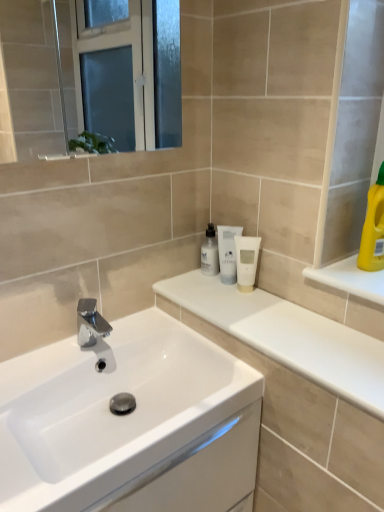
This screenshot has width=384, height=512. What do you see at coordinates (228, 253) in the screenshot? I see `transparent plastic bottle at center, marked as the second mouthwash in a left-to-right arrangement` at bounding box center [228, 253].

You are a GUI agent. You are given a task and a screenshot of the screen. Output one action in this format:
    pyautogui.click(x=<x>, y=<y>)
    Task: Click on the white matte tube at center, which ranks as the 1th mouthwash in right-to-left order
    This screenshot has height=512, width=384.
    Given the screenshot: What is the action you would take?
    pyautogui.click(x=246, y=261)

Describe the element at coordinates (298, 392) in the screenshot. The height and width of the screenshot is (512, 384). I see `white glossy counter at center` at that location.

Measure the distance between white glossy sink at center and camera.

They are 27.22 inches apart.

The width and height of the screenshot is (384, 512). Identify the location of chrome/metallic faucet at center. (90, 323).

I want to click on transparent plastic bottle at center, the second mouthwash from the right, so click(228, 253).

Is transparent plastic bottle at center, marked as the second mouthwash in a left-to-right arrangement, not close to white matte tube at center, positioned as the third mouthwash in left-to-right order?

They are positioned close to each other.

From a real-world perspective, relative to white matte tube at center, which ranks as the 1th mouthwash in right-to-left order, is transparent plastic bottle at center, the second mouthwash from the right, vertically above or below?

transparent plastic bottle at center, the second mouthwash from the right, is above white matte tube at center, which ranks as the 1th mouthwash in right-to-left order.

Is white matte tube at center, positioned as the third mouthwash in left-to-right order, a part of transparent plastic bottle at center, the second mouthwash from the right?

No, white matte tube at center, positioned as the third mouthwash in left-to-right order, is located outside of transparent plastic bottle at center, the second mouthwash from the right.

From the image's perspective, who appears lower, transparent plastic bottle at center, marked as the second mouthwash in a left-to-right arrangement, or white matte tube at center, positioned as the third mouthwash in left-to-right order?

white matte tube at center, positioned as the third mouthwash in left-to-right order, from the image's perspective.

Looking at this image, which object is positioned more to the right, white glossy counter at center or white matte tube at center, positioned as the third mouthwash in left-to-right order?

Positioned to the right is white glossy counter at center.

Are white glossy counter at center and white matte tube at center, positioned as the third mouthwash in left-to-right order, making contact?

No, white glossy counter at center is not with white matte tube at center, positioned as the third mouthwash in left-to-right order.

Is white glossy counter at center inside or outside of white matte tube at center, positioned as the third mouthwash in left-to-right order?

white glossy counter at center is located beyond the bounds of white matte tube at center, positioned as the third mouthwash in left-to-right order.

Which is behind, point (103, 325) or point (105, 489)?

The point (103, 325) is more distant.

Can you confirm if chrome/metallic faucet at center is smaller than white glossy sink at center?

Indeed, chrome/metallic faucet at center has a smaller size compared to white glossy sink at center.

From a real-world perspective, which object rests below the other?

In real-world perspective, white glossy sink at center is lower.

From the image's perspective, is chrome/metallic faucet at center above white glossy sink at center?

Yes, from the image's perspective, chrome/metallic faucet at center is on top of white glossy sink at center.

Is there a large distance between yellow plastic bottle at upper right and white glossy sink at center?

No, there isn't a large distance between yellow plastic bottle at upper right and white glossy sink at center.

Considering the positions of points (367, 269) and (132, 358), is point (367, 269) farther from camera compared to point (132, 358)?

No, it is in front of (132, 358).

How much distance is there between yellow plastic bottle at upper right and white glossy sink at center?

25.41 inches.

In terms of width, does white glossy bottle at center, which is the first mouthwash from left to right, look wider or thinner when compared to yellow plastic bottle at upper right?

Clearly, white glossy bottle at center, which is the first mouthwash from left to right, has less width compared to yellow plastic bottle at upper right.

In the scene shown: Would you say white glossy bottle at center, the 3th mouthwash positioned from the right, is outside yellow plastic bottle at upper right?

white glossy bottle at center, the 3th mouthwash positioned from the right, lies outside yellow plastic bottle at upper right's area.

Would you say white glossy bottle at center, the 3th mouthwash positioned from the right, is to the left or to the right of yellow plastic bottle at upper right in the picture?

Clearly, white glossy bottle at center, the 3th mouthwash positioned from the right, is on the left of yellow plastic bottle at upper right in the image.

Considering their positions, is white glossy bottle at center, which is the first mouthwash from left to right, located in front of or behind yellow plastic bottle at upper right?

Clearly, white glossy bottle at center, which is the first mouthwash from left to right, is behind yellow plastic bottle at upper right.

From the image's perspective, which is above, white matte tube at center, which ranks as the 1th mouthwash in right-to-left order, or yellow plastic bottle at upper right?

yellow plastic bottle at upper right appears higher in the image.

Considering the sizes of white matte tube at center, positioned as the third mouthwash in left-to-right order, and yellow plastic bottle at upper right in the image, is white matte tube at center, positioned as the third mouthwash in left-to-right order, taller or shorter than yellow plastic bottle at upper right?

white matte tube at center, positioned as the third mouthwash in left-to-right order, is shorter than yellow plastic bottle at upper right.

Consider the image. From a real-world perspective, is white matte tube at center, positioned as the third mouthwash in left-to-right order, under yellow plastic bottle at upper right?

Indeed, from a real-world perspective, white matte tube at center, positioned as the third mouthwash in left-to-right order, is positioned beneath yellow plastic bottle at upper right.

Could you measure the distance between white glossy counter at center and transparent plastic bottle at center, the second mouthwash from the right?

The distance of white glossy counter at center from transparent plastic bottle at center, the second mouthwash from the right, is 15.44 inches.

Considering the relative sizes of white glossy counter at center and transparent plastic bottle at center, the second mouthwash from the right, in the image provided, is white glossy counter at center thinner than transparent plastic bottle at center, the second mouthwash from the right,?

In fact, white glossy counter at center might be wider than transparent plastic bottle at center, the second mouthwash from the right.

Between white glossy counter at center and transparent plastic bottle at center, the second mouthwash from the right, which one appears on the left side from the viewer's perspective?

transparent plastic bottle at center, the second mouthwash from the right, is more to the left.

Would you say white glossy counter at center is a long distance from transparent plastic bottle at center, marked as the second mouthwash in a left-to-right arrangement?

That's not correct — white glossy counter at center is a little close to transparent plastic bottle at center, marked as the second mouthwash in a left-to-right arrangement.

Locate an element on the screen. mouthwash that appears below the transparent plastic bottle at center, marked as the second mouthwash in a left-to-right arrangement (from the image's perspective) is located at coordinates (246, 261).

Identify the location of counter that appears in front of the white matte tube at center, positioned as the third mouthwash in left-to-right order. (298, 392).

From the image, which object appears to be farther from white glossy sink at center, yellow plastic bottle at upper right or white glossy counter at center?

Based on the image, yellow plastic bottle at upper right appears to be further to white glossy sink at center.

From the image, which object appears to be farther from chrome/metallic faucet at center, white glossy counter at center or white glossy sink at center?

white glossy counter at center.

Considering their positions, is white glossy counter at center positioned further to white glossy sink at center than transparent plastic bottle at center, the second mouthwash from the right?

transparent plastic bottle at center, the second mouthwash from the right, is further to white glossy sink at center.

From the image, which object appears to be farther from white glossy sink at center, transparent plastic bottle at center, marked as the second mouthwash in a left-to-right arrangement, or white glossy counter at center?

transparent plastic bottle at center, marked as the second mouthwash in a left-to-right arrangement.

Which object lies nearer to the anchor point white glossy sink at center, chrome/metallic faucet at center or white matte tube at center, which ranks as the 1th mouthwash in right-to-left order?

chrome/metallic faucet at center is closer to white glossy sink at center.

From the image, which object appears to be farther from transparent plastic bottle at center, marked as the second mouthwash in a left-to-right arrangement, white matte tube at center, which ranks as the 1th mouthwash in right-to-left order, or chrome/metallic faucet at center?

Among the two, chrome/metallic faucet at center is located further to transparent plastic bottle at center, marked as the second mouthwash in a left-to-right arrangement.

From the image, which object appears to be nearer to white matte tube at center, positioned as the third mouthwash in left-to-right order, white glossy sink at center or yellow plastic bottle at upper right?

The object closer to white matte tube at center, positioned as the third mouthwash in left-to-right order, is yellow plastic bottle at upper right.

From the image, which object appears to be nearer to transparent plastic bottle at center, the second mouthwash from the right, white glossy sink at center or white glossy bottle at center, which is the first mouthwash from left to right?

The object closer to transparent plastic bottle at center, the second mouthwash from the right, is white glossy bottle at center, which is the first mouthwash from left to right.

Find the location of `counter located between white glossy sink at center and white glossy bottle at center, which is the first mouthwash from left to right, in the depth direction`. counter located between white glossy sink at center and white glossy bottle at center, which is the first mouthwash from left to right, in the depth direction is located at coordinates (298, 392).

This screenshot has width=384, height=512. I want to click on tap positioned between white glossy counter at center and transparent plastic bottle at center, the second mouthwash from the right, from near to far, so click(x=90, y=323).

Where is `tap located between white glossy sink at center and white matte tube at center, positioned as the third mouthwash in left-to-right order, in the depth direction`? tap located between white glossy sink at center and white matte tube at center, positioned as the third mouthwash in left-to-right order, in the depth direction is located at coordinates (90, 323).

In order to click on mouthwash between chrome/metallic faucet at center and transparent plastic bottle at center, marked as the second mouthwash in a left-to-right arrangement in this screenshot , I will do `click(210, 253)`.